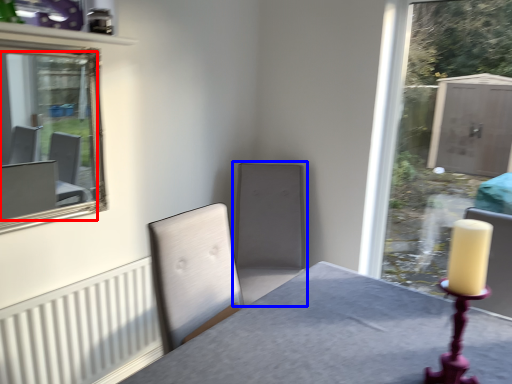
Question: Which of the following is the closest to the observer, mirror (highlighted by a red box) or swivel chair (highlighted by a blue box)?

Choices:
 (A) mirror
 (B) swivel chair

Answer: (A)